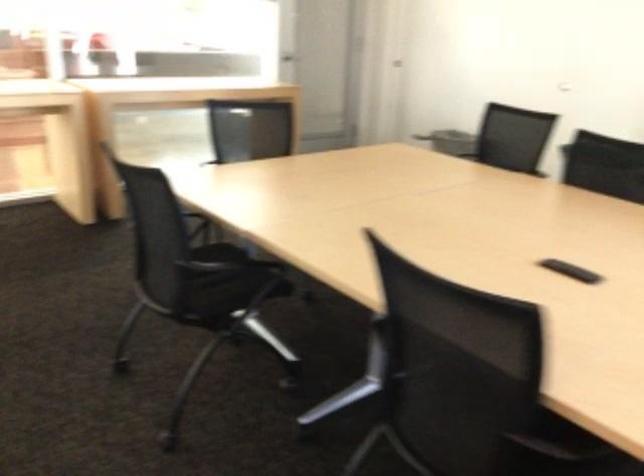
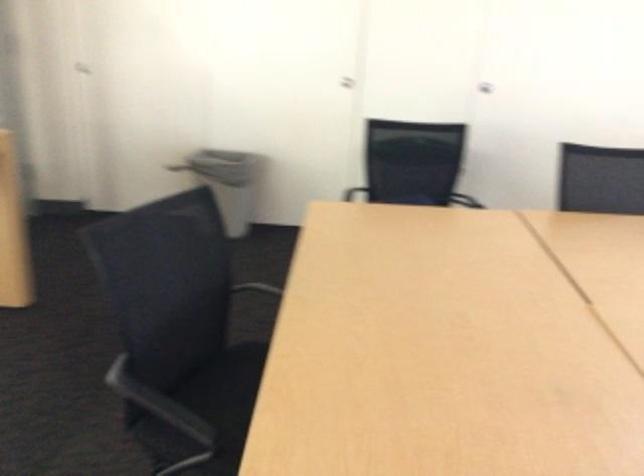
The point at (442, 151) is marked in the first image. Where is the corresponding point in the second image?

(231, 182)